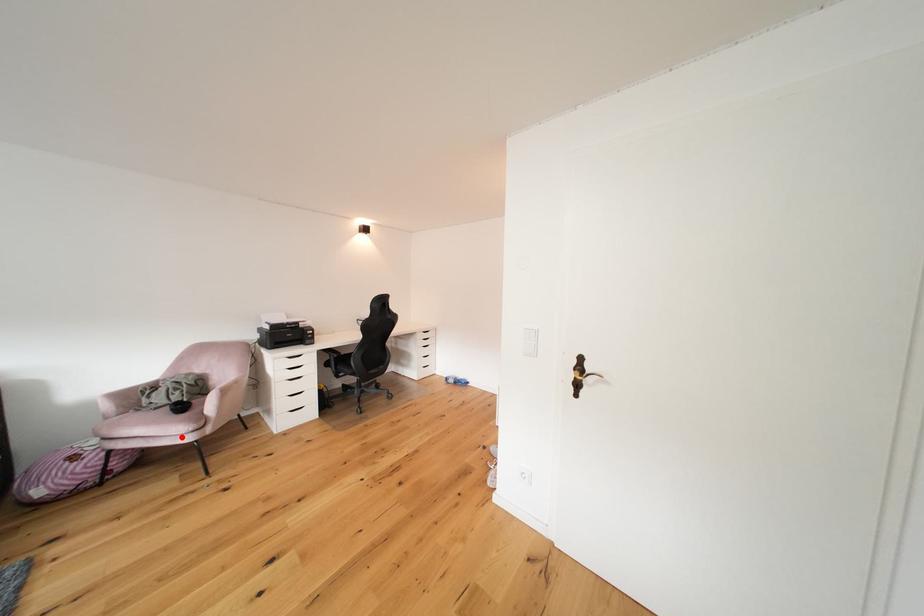
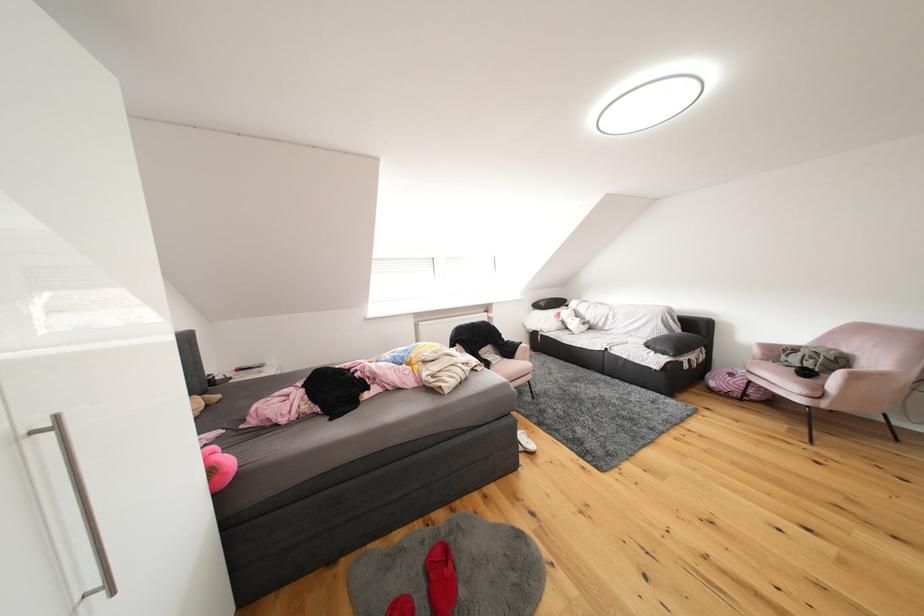
Locate, in the second image, the point that corresponds to the highlighted location in the first image.

(797, 392)